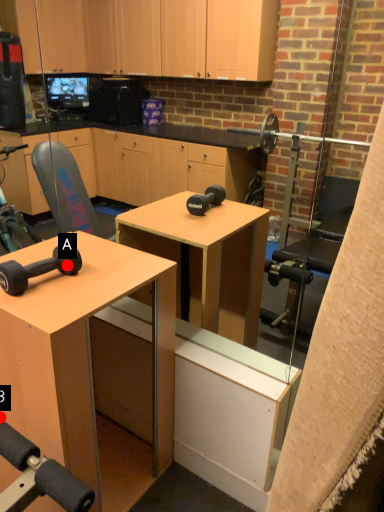
Question: Two points are circled on the image, labeled by A and B beside each circle. Which point is closer to the camera taking this photo?

Choices:
 (A) A is closer
 (B) B is closer

Answer: (A)